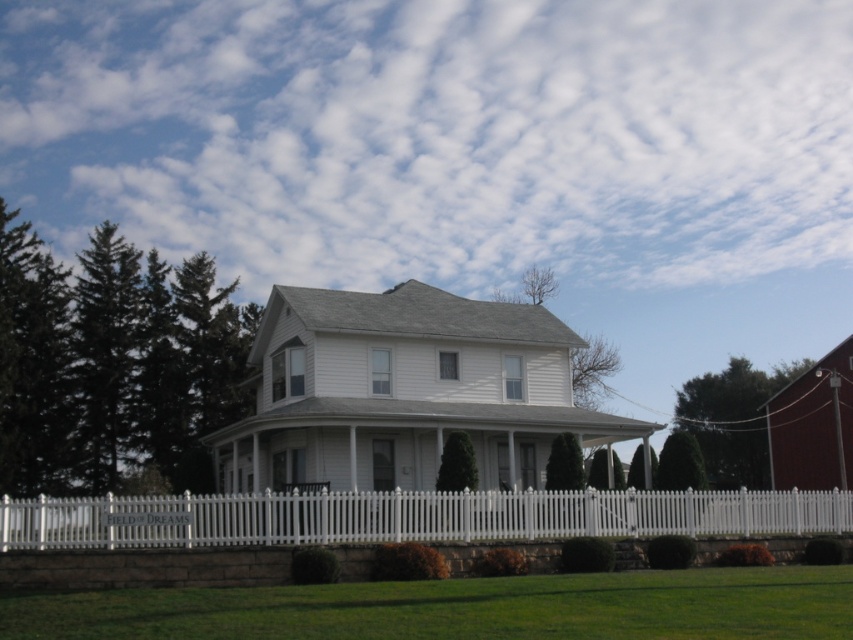
Question: Is green grass at lower center closer to the viewer compared to white picket fence at lower center?

Choices:
 (A) yes
 (B) no

Answer: (A)

Question: Does green grass at lower center have a greater width compared to white picket fence at lower center?

Choices:
 (A) yes
 (B) no

Answer: (B)

Question: Can you confirm if green grass at lower center is wider than white picket fence at lower center?

Choices:
 (A) yes
 (B) no

Answer: (B)

Question: Estimate the real-world distances between objects in this image. Which object is farther from the green grass at lower center?

Choices:
 (A) white wood barn at center
 (B) white picket fence at lower center

Answer: (A)

Question: Which object is positioned farthest from the green grass at lower center?

Choices:
 (A) white picket fence at lower center
 (B) white wood barn at center

Answer: (B)

Question: Which of the following is the farthest from the observer?

Choices:
 (A) white picket fence at lower center
 (B) green grass at lower center

Answer: (A)